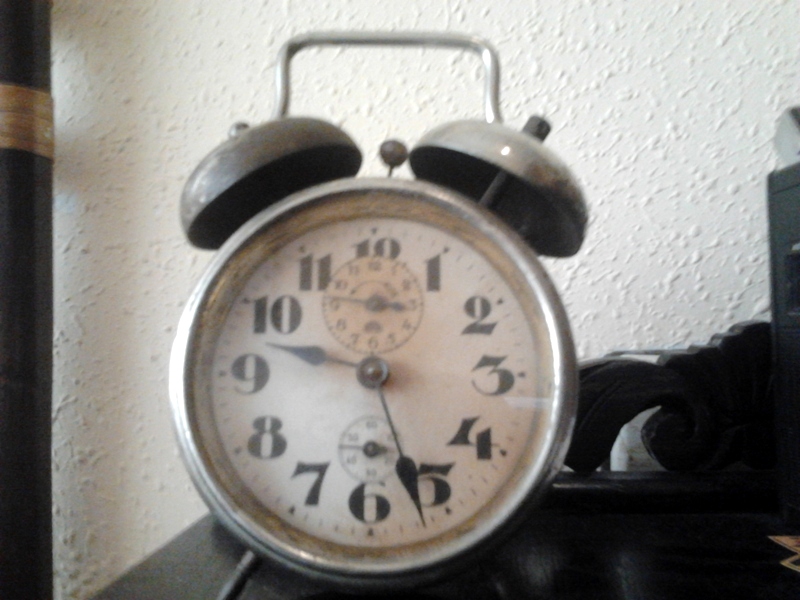
At what (x,y) coordinates should I click in order to perform the action: click on textured wall. Please return your answer as a coordinate pair (x, y). Image resolution: width=800 pixels, height=600 pixels. Looking at the image, I should click on (648, 109).